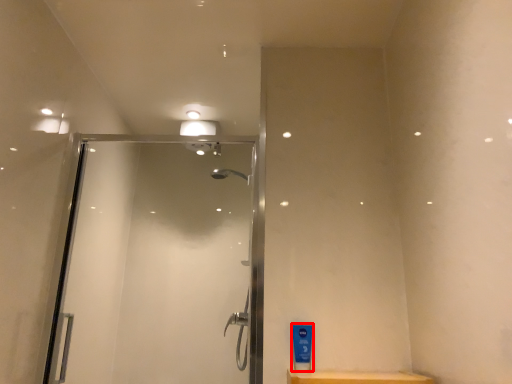
Question: From the image's perspective, where is toiletry (annotated by the red box) located in relation to screen door in the image?

Choices:
 (A) below
 (B) above

Answer: (A)